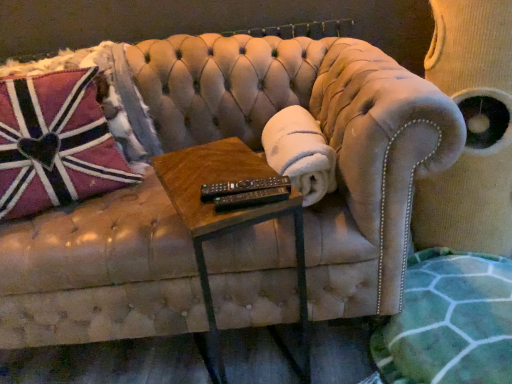
Question: Does white fluffy blanket at center come in front of green textured blanket at lower right?

Choices:
 (A) yes
 (B) no

Answer: (B)

Question: From the image's perspective, is white fluffy blanket at center under green textured blanket at lower right?

Choices:
 (A) no
 (B) yes

Answer: (A)

Question: Is white fluffy blanket at center directly adjacent to green textured blanket at lower right?

Choices:
 (A) no
 (B) yes

Answer: (A)

Question: Is white fluffy blanket at center to the right of green textured blanket at lower right from the viewer's perspective?

Choices:
 (A) yes
 (B) no

Answer: (B)

Question: Is white fluffy blanket at center completely or partially outside of green textured blanket at lower right?

Choices:
 (A) no
 (B) yes

Answer: (B)

Question: In terms of width, does woodenmaterial/texturetable at center look wider or thinner when compared to black plastic remote at center?

Choices:
 (A) thin
 (B) wide

Answer: (B)

Question: From the image's perspective, is woodenmaterial/texturetable at center located above or below black plastic remote at center?

Choices:
 (A) below
 (B) above

Answer: (A)

Question: Is woodenmaterial/texturetable at center in front of or behind black plastic remote at center in the image?

Choices:
 (A) front
 (B) behind

Answer: (A)

Question: In terms of height, does woodenmaterial/texturetable at center look taller or shorter compared to black plastic remote at center?

Choices:
 (A) tall
 (B) short

Answer: (A)

Question: In terms of height, does velvet swivel chair at upper right look taller or shorter compared to black plastic remote at center?

Choices:
 (A) tall
 (B) short

Answer: (A)

Question: Is velvet swivel chair at upper right spatially inside black plastic remote at center, or outside of it?

Choices:
 (A) outside
 (B) inside

Answer: (A)

Question: Is velvet swivel chair at upper right bigger or smaller than black plastic remote at center?

Choices:
 (A) small
 (B) big

Answer: (B)

Question: From the image's perspective, relative to black plastic remote at center, is velvet swivel chair at upper right above or below?

Choices:
 (A) below
 (B) above

Answer: (B)

Question: Is velvet swivel chair at upper right to the left or to the right of pink plush pillow at left in the image?

Choices:
 (A) left
 (B) right

Answer: (B)

Question: Is velvet swivel chair at upper right spatially inside pink plush pillow at left, or outside of it?

Choices:
 (A) outside
 (B) inside

Answer: (A)